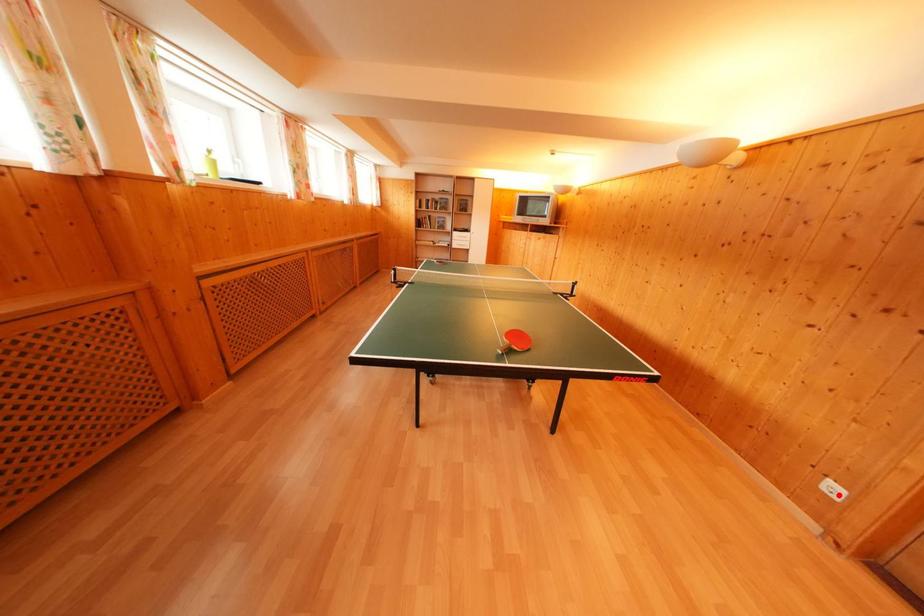
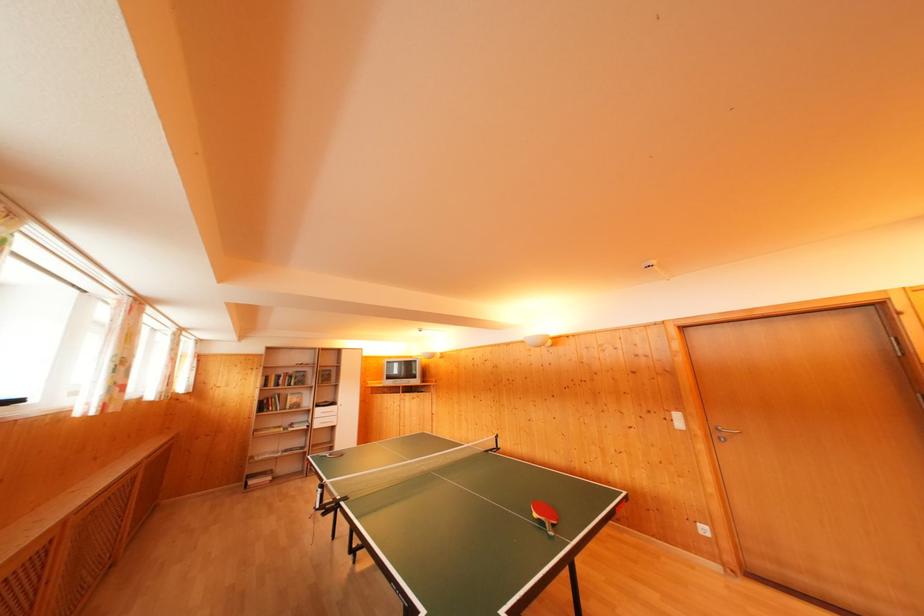
The point at the highlighted location is marked in the first image. Where is the corresponding point in the second image?

(709, 535)